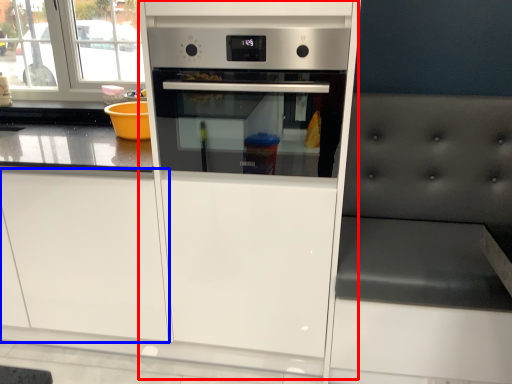
Question: Among these objects, which one is nearest to the camera, fridge (highlighted by a red box) or drawer (highlighted by a blue box)?

Choices:
 (A) fridge
 (B) drawer

Answer: (A)